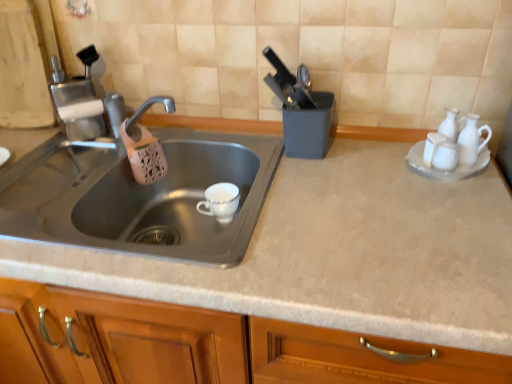
Identify the location of free space in front of white glossy salt shaker at upper right, which is the second tableware in left-to-right order. Image resolution: width=512 pixels, height=384 pixels. pyautogui.click(x=450, y=202).